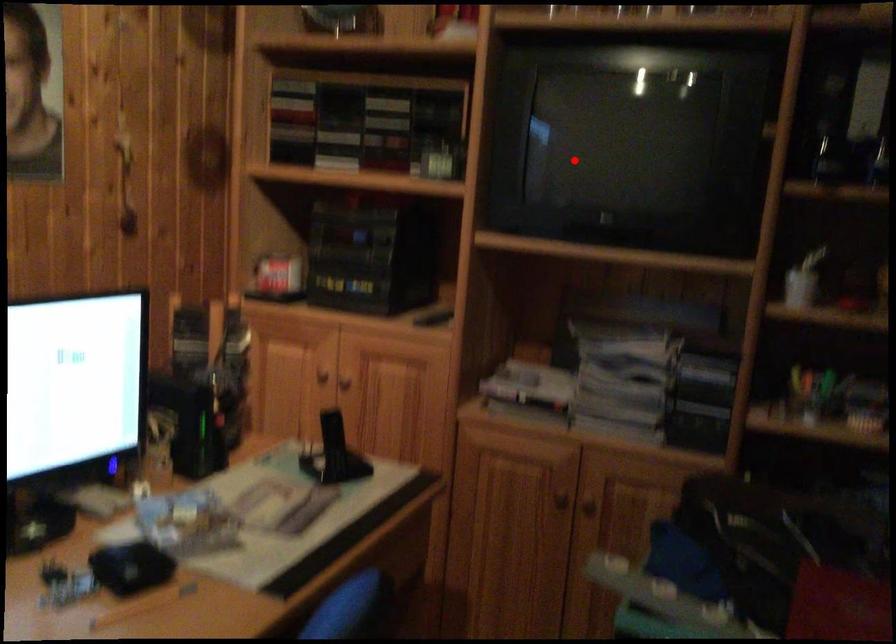
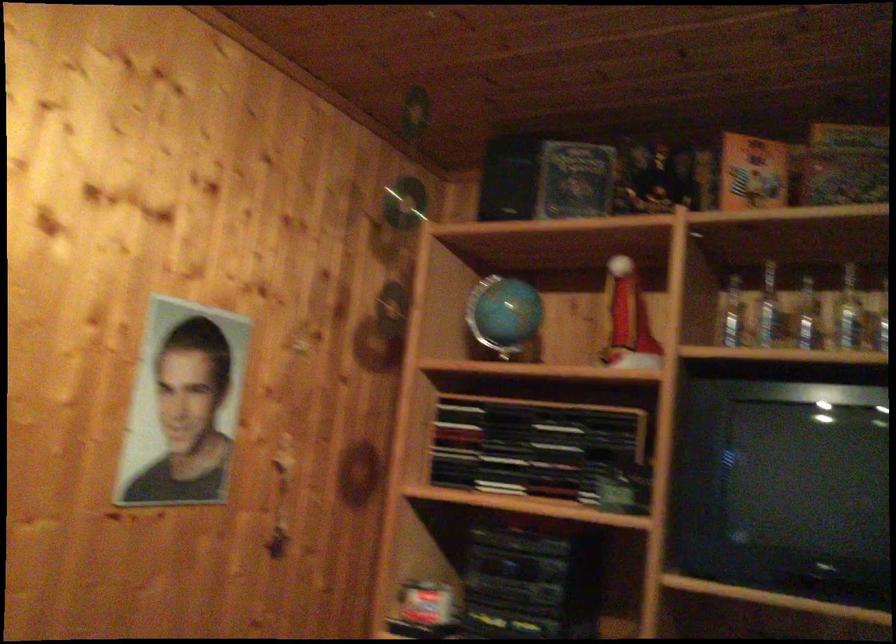
Question: I am providing you with two images of the same scene from different viewpoints. A red point is marked on the first image. Can you still see the location of the red point in image 2?

Choices:
 (A) Yes
 (B) No

Answer: (A)